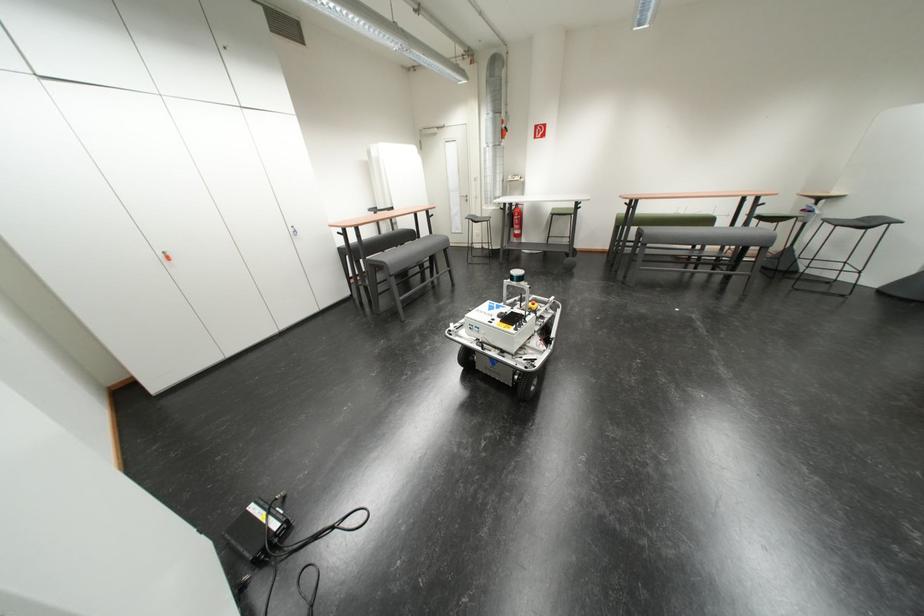
What do you see at coordinates (861, 222) in the screenshot?
I see `the chair sitting surface` at bounding box center [861, 222].